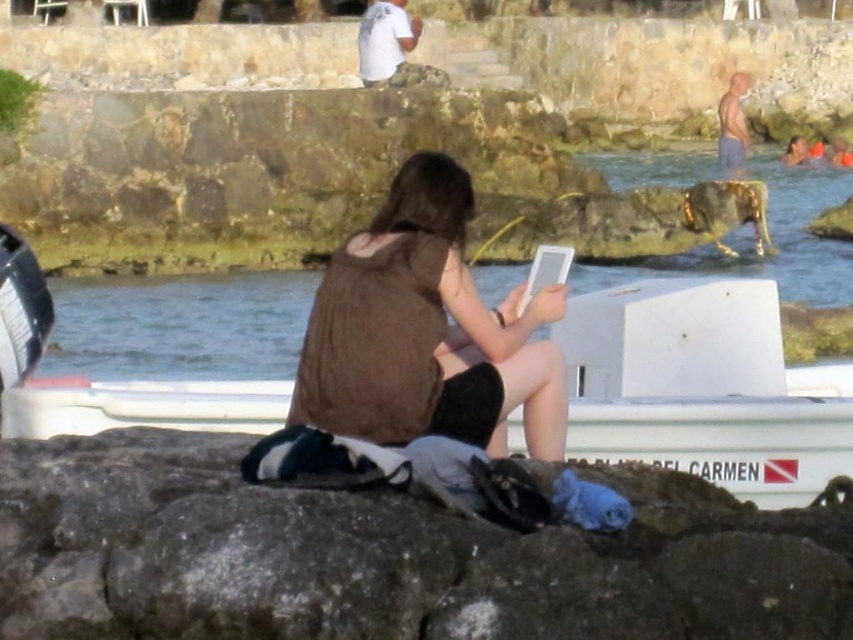
Who is more distant from viewer, (x=825, y=300) or (x=370, y=56)?

Point (x=370, y=56)

Who is shorter, gold metallic cow at upper center or white cotton shirt at upper center?

Standing shorter between the two is white cotton shirt at upper center.

Between point (712, 172) and point (410, 38), which one is positioned in front?

Positioned in front is point (410, 38).

Where is `gold metallic cow at upper center`? This screenshot has height=640, width=853. gold metallic cow at upper center is located at coordinates (770, 240).

Can you confirm if white matte boat at center is positioned below brown matte tank top at center?

No, white matte boat at center is not below brown matte tank top at center.

The height and width of the screenshot is (640, 853). Find the location of `white matte boat at center`. white matte boat at center is located at coordinates (703, 387).

Who is more forward, (732,323) or (802,275)?

Point (732,323)

Is point (260, 396) closer to viewer compared to point (815, 180)?

Yes, point (260, 396) is closer to viewer.

Where is `white matte boat at center`? white matte boat at center is located at coordinates (703, 387).